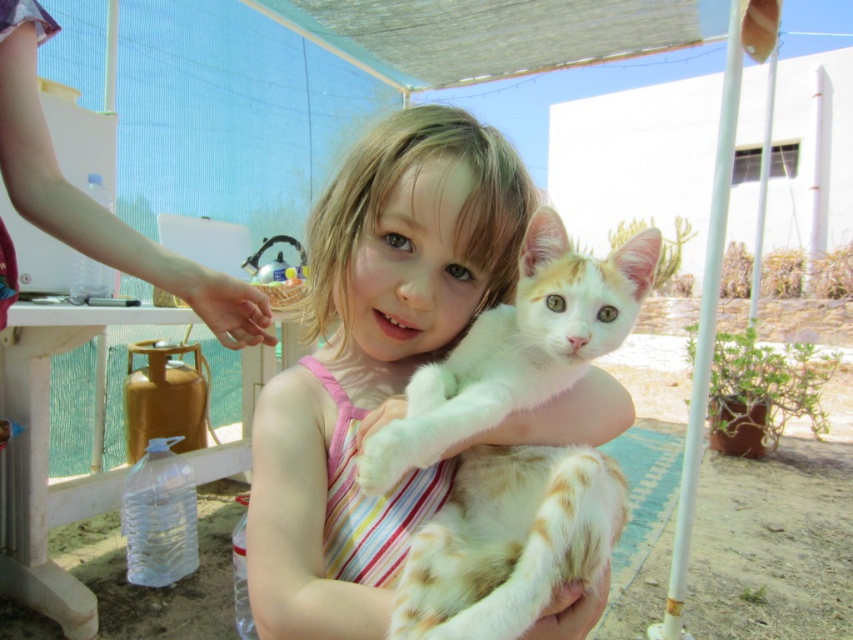
Question: Is white soft fabric dress at center bigger than white fluffy cat at center?

Choices:
 (A) no
 (B) yes

Answer: (B)

Question: Is white soft fabric dress at center thinner than white fluffy cat at center?

Choices:
 (A) yes
 (B) no

Answer: (B)

Question: Which of the following is the farthest from the observer?

Choices:
 (A) white soft fabric dress at center
 (B) white fluffy cat at center

Answer: (A)

Question: Can you confirm if white soft fabric dress at center is thinner than white fluffy cat at center?

Choices:
 (A) yes
 (B) no

Answer: (B)